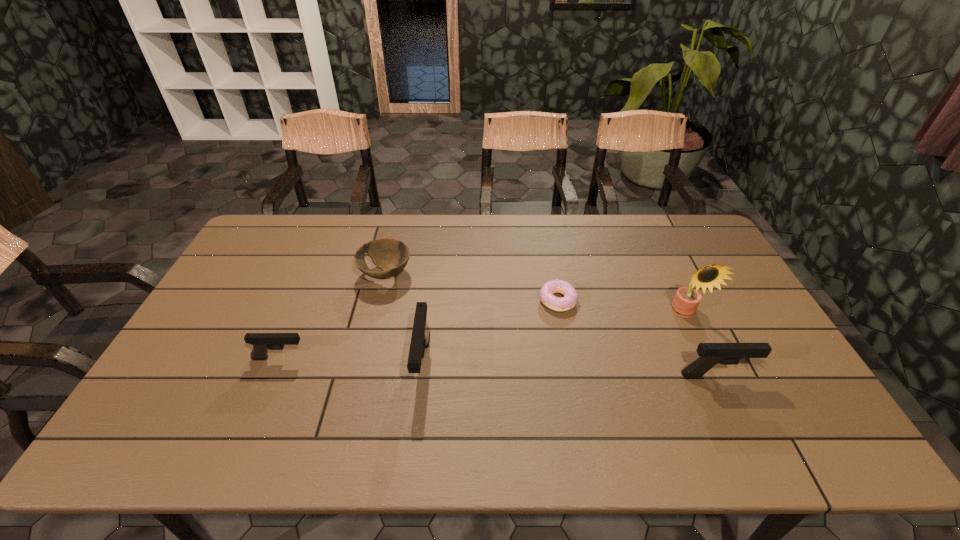
If equal spacing is desired by inserting an extra pistol among them, please point out a free spot for this new pistol. Please provide its 2D coordinates. Your answer should be formatted as a tuple, i.e. [(x, y)], where the tuple contains the x and y coordinates of a point satisfying the conditions above.

[(568, 369)]